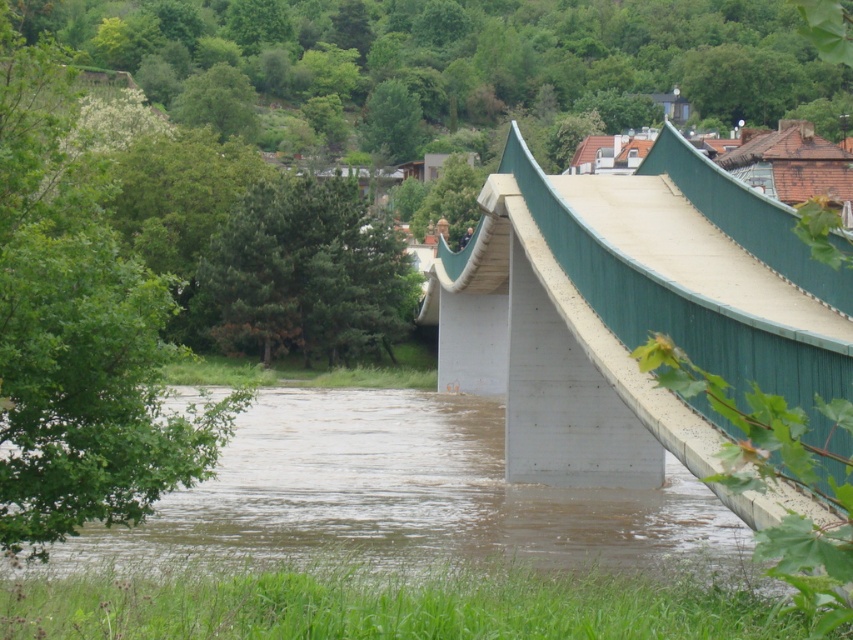
Is concrete bridge at center below brown concrete river at lower center?

No, concrete bridge at center is not below brown concrete river at lower center.

Who is shorter, concrete bridge at center or brown concrete river at lower center?

With less height is brown concrete river at lower center.

The image size is (853, 640). What do you see at coordinates (631, 310) in the screenshot?
I see `concrete bridge at center` at bounding box center [631, 310].

The width and height of the screenshot is (853, 640). Find the location of `concrete bridge at center`. concrete bridge at center is located at coordinates (631, 310).